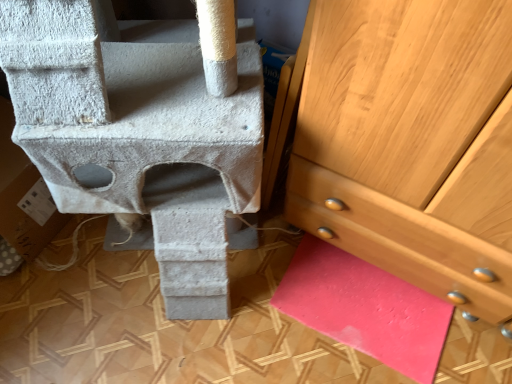
What is the approximate height of pink felt bath mat at lower right?

2.54 centimeters.

The height and width of the screenshot is (384, 512). In order to click on pink felt bath mat at lower right in this screenshot , I will do `click(365, 308)`.

The height and width of the screenshot is (384, 512). What do you see at coordinates (365, 308) in the screenshot? I see `pink felt bath mat at lower right` at bounding box center [365, 308].

At what (x,y) coordinates should I click in order to perform the action: click on pink felt bath mat at lower right. Please return your answer as a coordinate pair (x, y). Image resolution: width=512 pixels, height=384 pixels. Looking at the image, I should click on (365, 308).